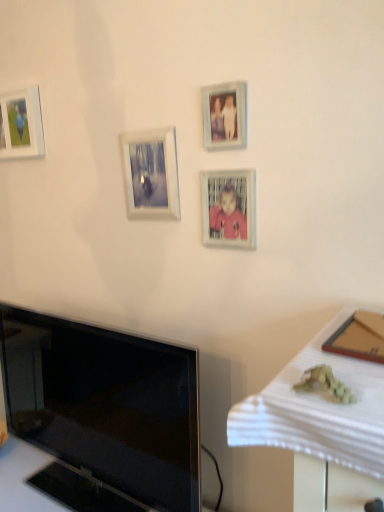
I want to click on light blue wooden picture frame at upper center, marked as the fourth picture frame in a back-to-front arrangement, so click(x=224, y=115).

How much space does light blue wooden picture frame at upper center, marked as the fourth picture frame in a back-to-front arrangement, occupy horizontally?

1.14 inches.

Describe the element at coordinates (152, 173) in the screenshot. I see `matte glass photo frame at upper center, which ranks as the third picture frame in front-to-back order` at that location.

Locate an element on the screen. This screenshot has width=384, height=512. black glossy tv at lower left is located at coordinates pos(105,404).

This screenshot has width=384, height=512. Describe the element at coordinates (105, 404) in the screenshot. I see `black glossy tv at lower left` at that location.

The height and width of the screenshot is (512, 384). In order to click on light blue wooden picture frame at upper center, acting as the 2th picture frame starting from the right in this screenshot , I will do `click(224, 115)`.

Find the location of a particular element. the 1st picture frame directly above the matte glass photo frame at upper center, marked as the 2th picture frame in a back-to-front arrangement (from a real-world perspective) is located at coordinates (224, 115).

Is matte glass photo frame at upper center, marked as the 2th picture frame in a left-to-right arrangement, oriented towards light blue wooden picture frame at upper center, marked as the fourth picture frame in a back-to-front arrangement?

No, matte glass photo frame at upper center, marked as the 2th picture frame in a left-to-right arrangement, is not aimed at light blue wooden picture frame at upper center, marked as the fourth picture frame in a back-to-front arrangement.

Does matte glass photo frame at upper center, which ranks as the third picture frame in front-to-back order, contain light blue wooden picture frame at upper center, marked as the third picture frame in a left-to-right arrangement?

No, light blue wooden picture frame at upper center, marked as the third picture frame in a left-to-right arrangement, is located outside of matte glass photo frame at upper center, which ranks as the third picture frame in front-to-back order.

Which is in front, matte white picture frame at upper left, acting as the 4th picture frame starting from the front, or matte plastic picture frame at center, the first picture frame from the right?

matte plastic picture frame at center, the first picture frame from the right.

Between matte white picture frame at upper left, the 4th picture frame positioned from the right, and matte plastic picture frame at center, which appears as the 2th picture frame when viewed from the front, which one has smaller size?

With smaller size is matte plastic picture frame at center, which appears as the 2th picture frame when viewed from the front.

Can you tell me how much matte white picture frame at upper left, acting as the 4th picture frame starting from the front, and matte plastic picture frame at center, which is counted as the third picture frame, starting from the back, differ in facing direction?

There is a 0.0978-degree angle between the facing directions of matte white picture frame at upper left, acting as the 4th picture frame starting from the front, and matte plastic picture frame at center, which is counted as the third picture frame, starting from the back.

Does matte white picture frame at upper left, the 4th picture frame positioned from the right, have a greater width compared to matte plastic picture frame at center, which is the fourth picture frame in left-to-right order?

Yes.

Is the position of matte glass photo frame at upper center, the 3th picture frame in the right-to-left sequence, more distant than that of matte plastic picture frame at center, which is the fourth picture frame in left-to-right order?

Yes, matte glass photo frame at upper center, the 3th picture frame in the right-to-left sequence, is further from the camera.

Is matte glass photo frame at upper center, marked as the 2th picture frame in a left-to-right arrangement, looking in the opposite direction of matte plastic picture frame at center, which is the fourth picture frame in left-to-right order?

matte glass photo frame at upper center, marked as the 2th picture frame in a left-to-right arrangement, does not have its back to matte plastic picture frame at center, which is the fourth picture frame in left-to-right order.

Does matte glass photo frame at upper center, the 3th picture frame in the right-to-left sequence, have a lesser height compared to matte plastic picture frame at center, which is counted as the third picture frame, starting from the back?

Incorrect, the height of matte glass photo frame at upper center, the 3th picture frame in the right-to-left sequence, does not fall short of that of matte plastic picture frame at center, which is counted as the third picture frame, starting from the back.

The image size is (384, 512). I want to click on picture frame below the matte glass photo frame at upper center, which ranks as the third picture frame in front-to-back order (from a real-world perspective), so click(x=229, y=208).

Can you confirm if matte plastic picture frame at center, which appears as the 2th picture frame when viewed from the front, is wider than matte glass photo frame at upper center, which ranks as the third picture frame in front-to-back order?

Incorrect, the width of matte plastic picture frame at center, which appears as the 2th picture frame when viewed from the front, does not surpass that of matte glass photo frame at upper center, which ranks as the third picture frame in front-to-back order.

Who is bigger, matte plastic picture frame at center, the first picture frame from the right, or matte glass photo frame at upper center, which ranks as the third picture frame in front-to-back order?

Bigger between the two is matte glass photo frame at upper center, which ranks as the third picture frame in front-to-back order.

From the image's perspective, which is below, matte plastic picture frame at center, which is counted as the third picture frame, starting from the back, or matte glass photo frame at upper center, the 3th picture frame in the right-to-left sequence?

matte plastic picture frame at center, which is counted as the third picture frame, starting from the back, is shown below in the image.

Locate an element on the screen. The height and width of the screenshot is (512, 384). picture frame above the light blue wooden picture frame at upper center, acting as the 2th picture frame starting from the right (from the image's perspective) is located at coordinates (21, 124).

Is light blue wooden picture frame at upper center, marked as the third picture frame in a left-to-right arrangement, far away from matte white picture frame at upper left, the 1th picture frame positioned from the left?

They are positioned close to each other.

Does light blue wooden picture frame at upper center, marked as the third picture frame in a left-to-right arrangement, turn towards matte white picture frame at upper left, the 4th picture frame positioned from the right?

No, light blue wooden picture frame at upper center, marked as the third picture frame in a left-to-right arrangement, is not facing towards matte white picture frame at upper left, the 4th picture frame positioned from the right.

From a real-world perspective, who is located higher, light blue wooden picture frame at upper center, marked as the third picture frame in a left-to-right arrangement, or matte white picture frame at upper left, the 1th picture frame viewed from the back?

matte white picture frame at upper left, the 1th picture frame viewed from the back.

Is matte glass photo frame at upper center, marked as the 2th picture frame in a left-to-right arrangement, next to black glossy tv at lower left and touching it?

No, matte glass photo frame at upper center, marked as the 2th picture frame in a left-to-right arrangement, is not in contact with black glossy tv at lower left.

Is matte glass photo frame at upper center, the 3th picture frame in the right-to-left sequence, not within black glossy tv at lower left?

Indeed, matte glass photo frame at upper center, the 3th picture frame in the right-to-left sequence, is completely outside black glossy tv at lower left.

Is matte glass photo frame at upper center, the 3th picture frame in the right-to-left sequence, taller or shorter than black glossy tv at lower left?

In the image, matte glass photo frame at upper center, the 3th picture frame in the right-to-left sequence, appears to be shorter than black glossy tv at lower left.

Looking at this image, is matte glass photo frame at upper center, the 3th picture frame in the right-to-left sequence, oriented away from black glossy tv at lower left?

No, matte glass photo frame at upper center, the 3th picture frame in the right-to-left sequence,'s orientation is not away from black glossy tv at lower left.

Are black glossy tv at lower left and matte plastic picture frame at center, which is counted as the third picture frame, starting from the back, located far from each other?

No, black glossy tv at lower left is not far away from matte plastic picture frame at center, which is counted as the third picture frame, starting from the back.

Where is `television in front of the matte plastic picture frame at center, the first picture frame from the right`? television in front of the matte plastic picture frame at center, the first picture frame from the right is located at coordinates (105, 404).

Is the position of black glossy tv at lower left more distant than that of matte plastic picture frame at center, which is counted as the third picture frame, starting from the back?

No, black glossy tv at lower left is in front of matte plastic picture frame at center, which is counted as the third picture frame, starting from the back.

Between black glossy tv at lower left and matte plastic picture frame at center, which is counted as the third picture frame, starting from the back, which one has more height?

black glossy tv at lower left.

This screenshot has height=512, width=384. Identify the location of picture frame that is the 2nd one when counting backward from the light blue wooden picture frame at upper center, marked as the third picture frame in a left-to-right arrangement. (152, 173).

Starting from the matte white picture frame at upper left, acting as the 4th picture frame starting from the front, which picture frame is the 2nd one in front? Please provide its 2D coordinates.

[(229, 208)]

When comparing their distances from matte plastic picture frame at center, which appears as the 2th picture frame when viewed from the front, does light blue wooden picture frame at upper center, marked as the fourth picture frame in a back-to-front arrangement, or black glossy tv at lower left seem further?

The object further to matte plastic picture frame at center, which appears as the 2th picture frame when viewed from the front, is black glossy tv at lower left.

Consider the image. From the image, which object appears to be farther from light blue wooden picture frame at upper center, acting as the 2th picture frame starting from the right, matte white picture frame at upper left, the 4th picture frame positioned from the right, or black glossy tv at lower left?

black glossy tv at lower left is further to light blue wooden picture frame at upper center, acting as the 2th picture frame starting from the right.

Considering their positions, is black glossy tv at lower left positioned further to matte white picture frame at upper left, acting as the 4th picture frame starting from the front, than matte plastic picture frame at center, the first picture frame from the right?

Based on the image, black glossy tv at lower left appears to be further to matte white picture frame at upper left, acting as the 4th picture frame starting from the front.

Looking at the image, which one is located closer to light blue wooden picture frame at upper center, the first picture frame in the front-to-back sequence, matte glass photo frame at upper center, which ranks as the third picture frame in front-to-back order, or matte plastic picture frame at center, which appears as the 2th picture frame when viewed from the front?

Among the two, matte plastic picture frame at center, which appears as the 2th picture frame when viewed from the front, is located nearer to light blue wooden picture frame at upper center, the first picture frame in the front-to-back sequence.

From the picture: Looking at the image, which one is located closer to matte glass photo frame at upper center, the 3th picture frame in the right-to-left sequence, light blue wooden picture frame at upper center, marked as the fourth picture frame in a back-to-front arrangement, or matte plastic picture frame at center, the first picture frame from the right?

The object closer to matte glass photo frame at upper center, the 3th picture frame in the right-to-left sequence, is matte plastic picture frame at center, the first picture frame from the right.

When comparing their distances from matte white picture frame at upper left, the 1th picture frame positioned from the left, does matte plastic picture frame at center, the first picture frame from the right, or light blue wooden picture frame at upper center, marked as the fourth picture frame in a back-to-front arrangement, seem further?

matte plastic picture frame at center, the first picture frame from the right.

Considering their positions, is light blue wooden picture frame at upper center, the first picture frame in the front-to-back sequence, positioned closer to black glossy tv at lower left than matte white picture frame at upper left, the 1th picture frame positioned from the left?

matte white picture frame at upper left, the 1th picture frame positioned from the left.

Looking at the image, which one is located closer to matte plastic picture frame at center, which is the fourth picture frame in left-to-right order, matte white picture frame at upper left, acting as the 4th picture frame starting from the front, or light blue wooden picture frame at upper center, the first picture frame in the front-to-back sequence?

Among the two, light blue wooden picture frame at upper center, the first picture frame in the front-to-back sequence, is located nearer to matte plastic picture frame at center, which is the fourth picture frame in left-to-right order.

Find the location of a particular element. The width and height of the screenshot is (384, 512). picture frame between matte white picture frame at upper left, the 1th picture frame positioned from the left, and light blue wooden picture frame at upper center, marked as the third picture frame in a left-to-right arrangement, from left to right is located at coordinates (152, 173).

Find the location of a particular element. The image size is (384, 512). picture frame that lies between matte glass photo frame at upper center, the 3th picture frame in the right-to-left sequence, and black glossy tv at lower left from top to bottom is located at coordinates (229, 208).

Where is `picture frame between matte glass photo frame at upper center, marked as the 2th picture frame in a left-to-right arrangement, and matte plastic picture frame at center, which is counted as the third picture frame, starting from the back`? picture frame between matte glass photo frame at upper center, marked as the 2th picture frame in a left-to-right arrangement, and matte plastic picture frame at center, which is counted as the third picture frame, starting from the back is located at coordinates (224, 115).